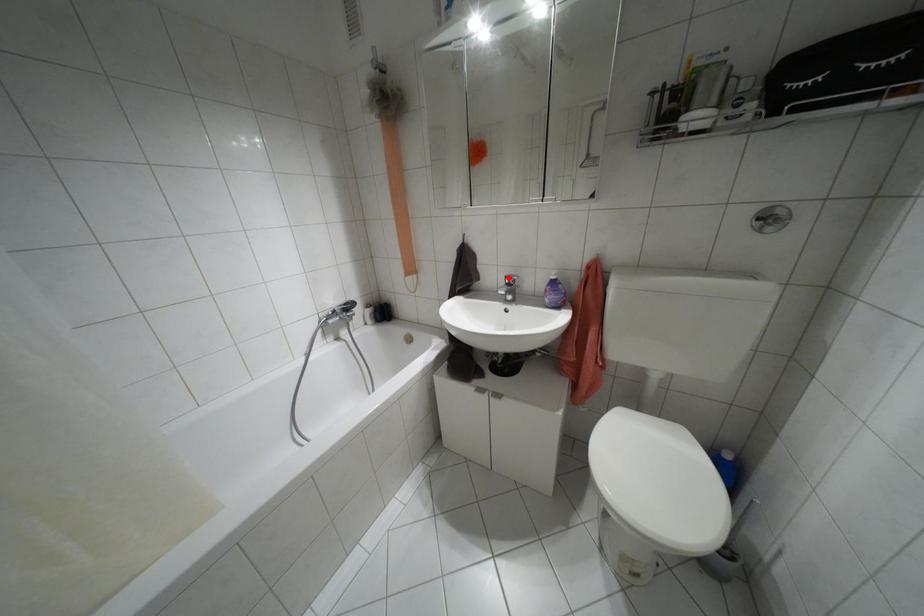
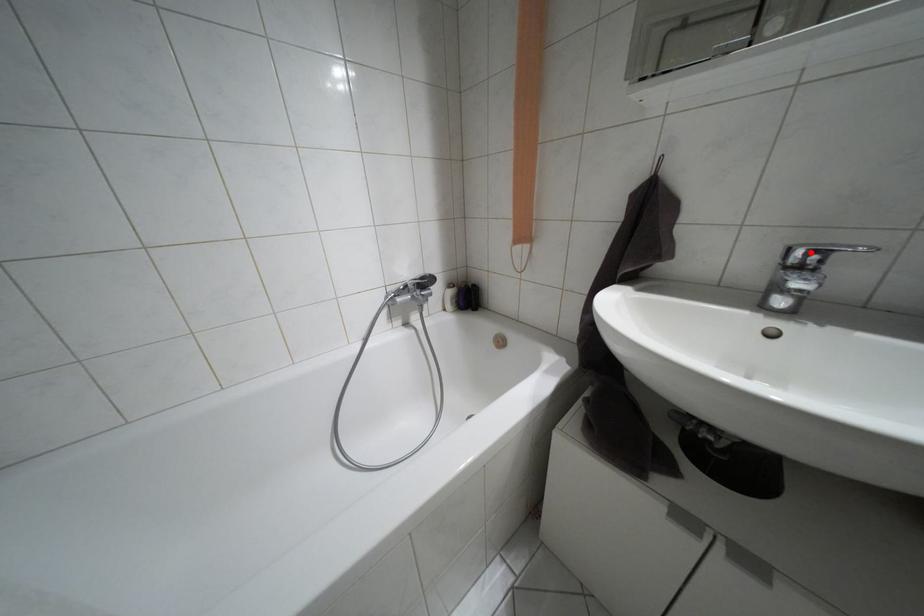
I am providing you with two images of the same scene from different viewpoints. A red point is marked on the first image and another point is marked on the second image. Do the highlighted points in image1 and image2 indicate the same real-world spot?

Yes